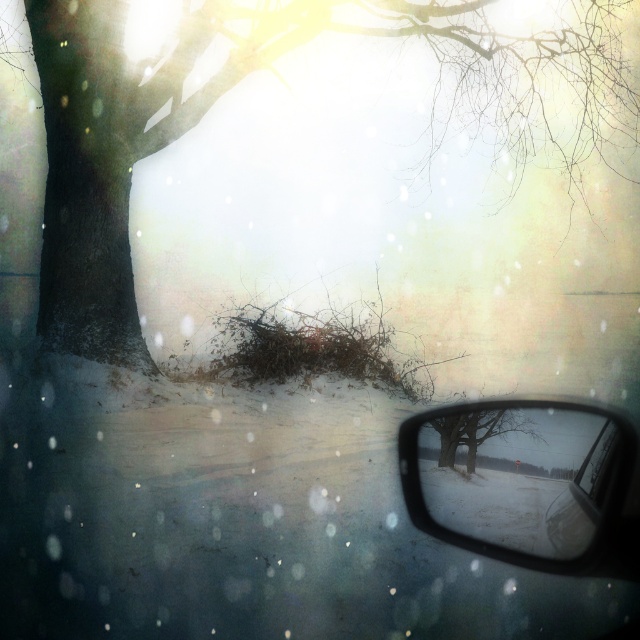
Question: Which of the following is the closest to the observer?

Choices:
 (A) (493, 456)
 (B) (484, 20)

Answer: (A)

Question: Is brown textured tree at upper left closer to the viewer compared to clear plastic side mirror at lower right?

Choices:
 (A) no
 (B) yes

Answer: (A)

Question: Is brown textured tree at upper left bigger than clear plastic side mirror at lower right?

Choices:
 (A) no
 (B) yes

Answer: (B)

Question: Is brown textured tree at upper left to the right of clear plastic side mirror at lower right from the viewer's perspective?

Choices:
 (A) yes
 (B) no

Answer: (B)

Question: Among these points, which one is nearest to the camera?

Choices:
 (A) (444, 480)
 (B) (97, 108)

Answer: (A)